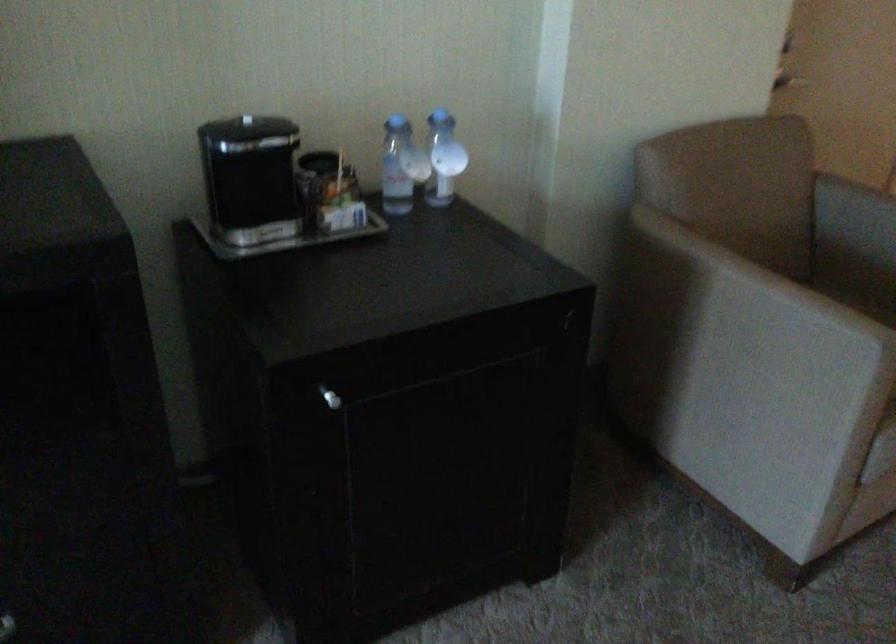
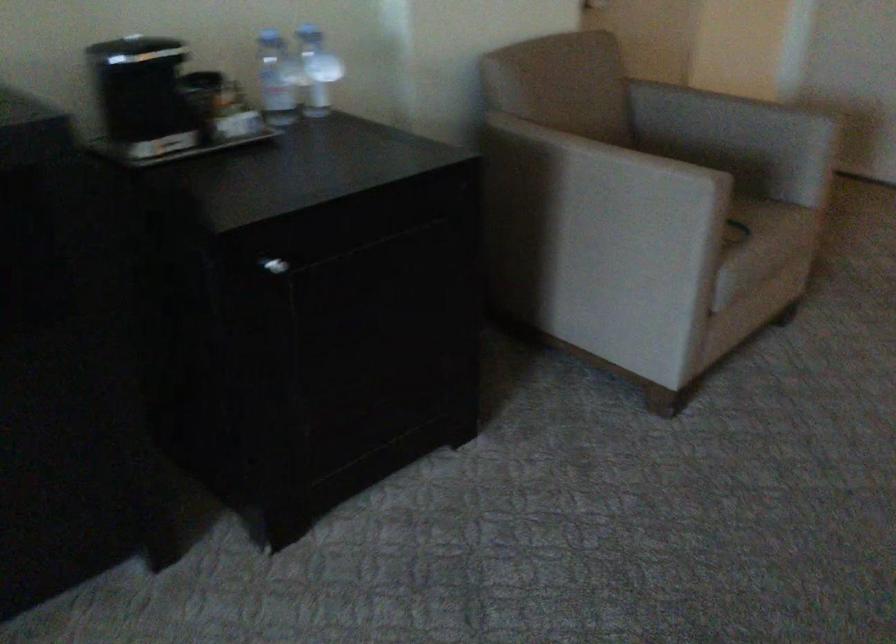
Question: Based on the continuous images, in which direction is the camera rotating? Reply with the corresponding letter.

Choices:
 (A) Left
 (B) Right
 (C) Up
 (D) Down

Answer: (B)